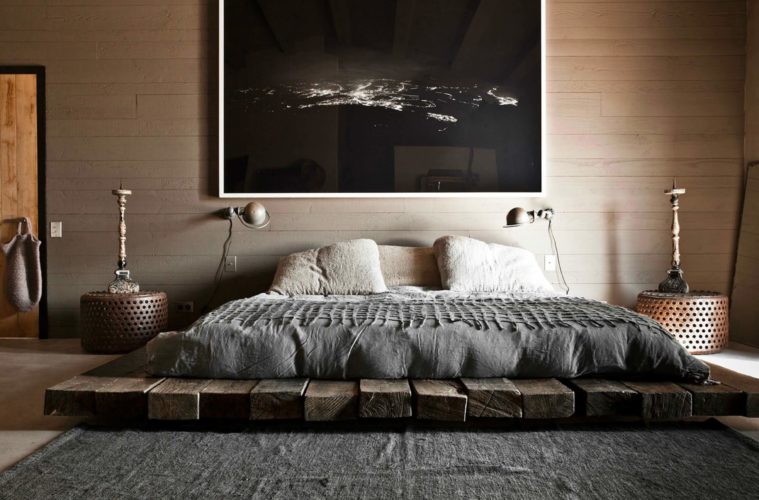
Find the location of a particular element. This screenshot has width=759, height=500. floor is located at coordinates (27, 437).